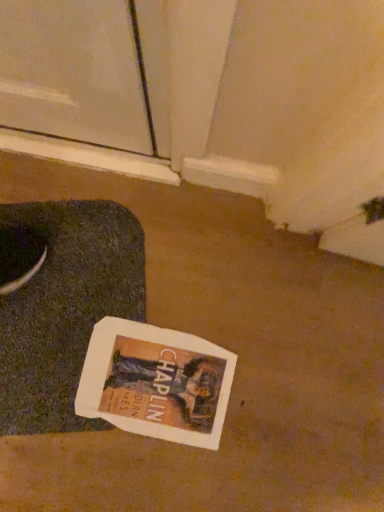
Where is `empty space that is to the right of dark gray textured yoga mat at lower left`? empty space that is to the right of dark gray textured yoga mat at lower left is located at coordinates (225, 388).